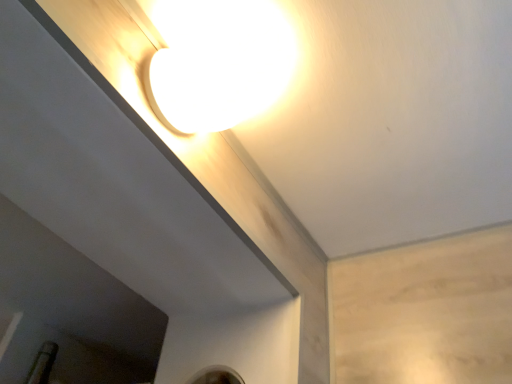
What do you see at coordinates (218, 62) in the screenshot?
I see `matte white lamp at upper center` at bounding box center [218, 62].

Locate an element on the screen. This screenshot has width=512, height=384. matte white lamp at upper center is located at coordinates (218, 62).

Find the location of a particular element. The image size is (512, 384). matte white lamp at upper center is located at coordinates (218, 62).